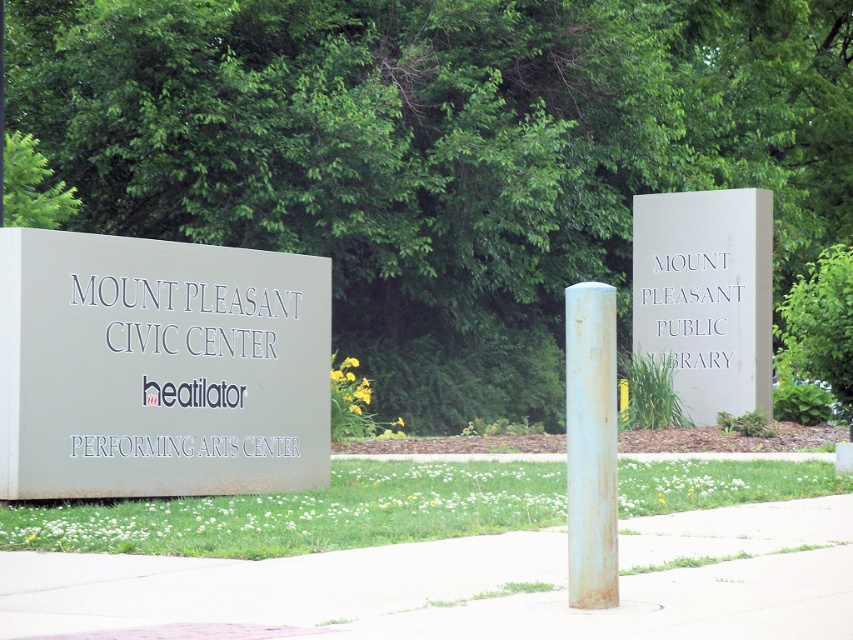
Measure the distance from matte gray sign at left to rusty metal pole at center.

4.10 meters

This screenshot has width=853, height=640. What do you see at coordinates (160, 368) in the screenshot?
I see `matte gray sign at left` at bounding box center [160, 368].

Where is `matte gray sign at left`? Image resolution: width=853 pixels, height=640 pixels. matte gray sign at left is located at coordinates (160, 368).

Locate an element on the screen. matte gray sign at left is located at coordinates (160, 368).

Is point (33, 477) in front of point (746, 320)?

Yes, point (33, 477) is closer to viewer.

Who is more forward, (125, 296) or (746, 408)?

Point (125, 296) is in front.

What do you see at coordinates (160, 368) in the screenshot? I see `matte gray sign at left` at bounding box center [160, 368].

This screenshot has width=853, height=640. Find the location of `matte gray sign at left`. matte gray sign at left is located at coordinates (160, 368).

Is point (674, 234) behind point (598, 500)?

Yes, point (674, 234) is behind point (598, 500).

Consider the image. Can you confirm if white stone sign at center is taller than rusty metal pole at center?

Correct, white stone sign at center is much taller as rusty metal pole at center.

Between point (757, 241) and point (601, 545), which one is positioned in front?

Point (601, 545) is more forward.

This screenshot has height=640, width=853. Identify the location of white stone sign at center. (706, 296).